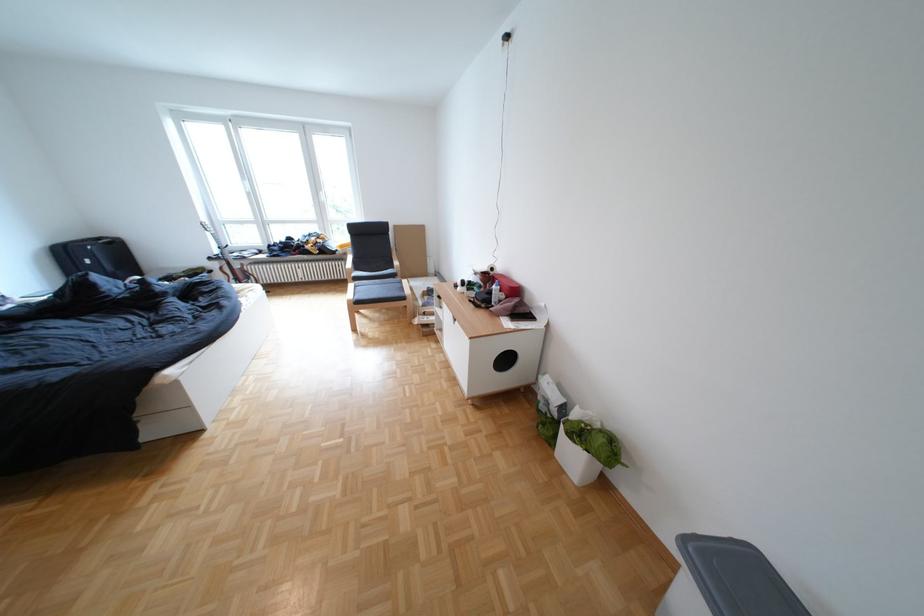
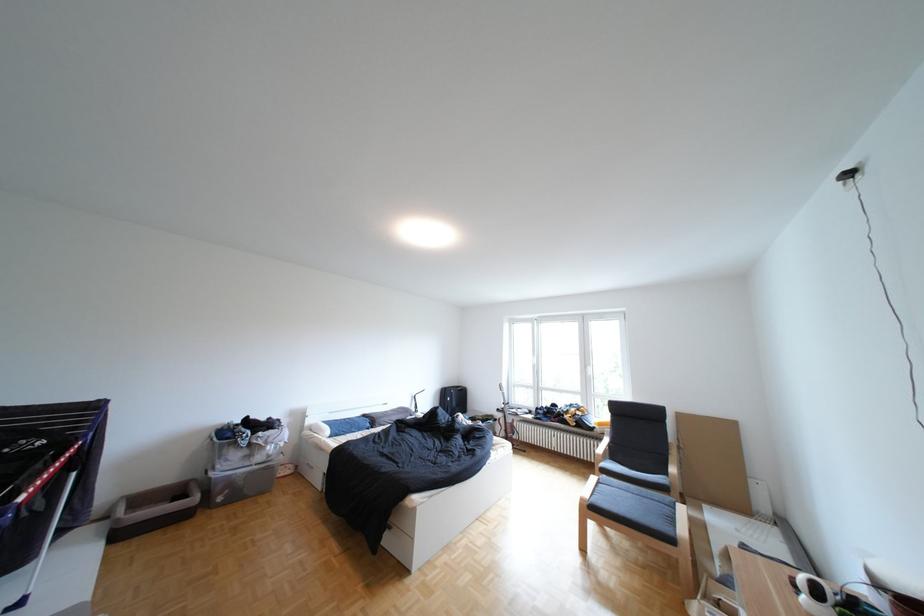
Based on the continuous images, in which direction is the camera rotating?

The rotation direction of the camera is left-up.